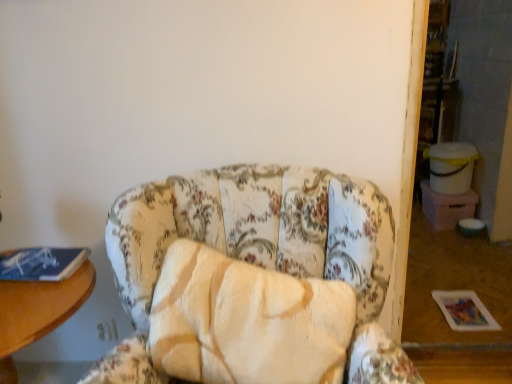
Question: Is the position of blue matte book at left less distant than that of wooden table at left?

Choices:
 (A) no
 (B) yes

Answer: (A)

Question: From a real-world perspective, is blue matte book at left located beneath wooden table at left?

Choices:
 (A) no
 (B) yes

Answer: (A)

Question: Considering the relative positions of blue matte book at left and wooden table at left in the image provided, is blue matte book at left to the right of wooden table at left from the viewer's perspective?

Choices:
 (A) no
 (B) yes

Answer: (B)

Question: From the image's perspective, is blue matte book at left beneath wooden table at left?

Choices:
 (A) yes
 (B) no

Answer: (B)

Question: Is blue matte book at left with wooden table at left?

Choices:
 (A) no
 (B) yes

Answer: (A)

Question: From a real-world perspective, relative to floral fabric chair at center, is wooden table at left vertically above or below?

Choices:
 (A) above
 (B) below

Answer: (B)

Question: Is wooden table at left bigger or smaller than floral fabric chair at center?

Choices:
 (A) small
 (B) big

Answer: (A)

Question: Is wooden table at left spatially inside floral fabric chair at center, or outside of it?

Choices:
 (A) inside
 (B) outside

Answer: (B)

Question: Relative to floral fabric chair at center, is wooden table at left in front or behind?

Choices:
 (A) front
 (B) behind

Answer: (B)

Question: Considering the positions of point (4, 370) and point (20, 249), is point (4, 370) closer or farther from the camera than point (20, 249)?

Choices:
 (A) closer
 (B) farther

Answer: (A)

Question: In the image, is wooden table at left positioned in front of or behind blue matte book at left?

Choices:
 (A) front
 (B) behind

Answer: (A)

Question: Is wooden table at left bigger or smaller than blue matte book at left?

Choices:
 (A) small
 (B) big

Answer: (B)

Question: From the image's perspective, is wooden table at left positioned above or below blue matte book at left?

Choices:
 (A) below
 (B) above

Answer: (A)

Question: In the image, is blue matte book at left positioned in front of or behind floral fabric chair at center?

Choices:
 (A) front
 (B) behind

Answer: (B)

Question: From a real-world perspective, relative to floral fabric chair at center, is blue matte book at left vertically above or below?

Choices:
 (A) above
 (B) below

Answer: (A)